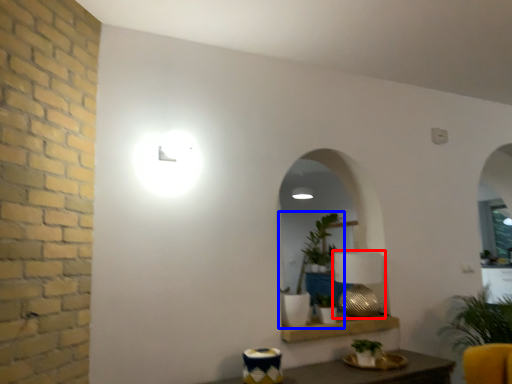
Question: Which object is further to the camera taking this photo, table lamp (highlighted by a red box) or houseplant (highlighted by a blue box)?

Choices:
 (A) table lamp
 (B) houseplant

Answer: (A)